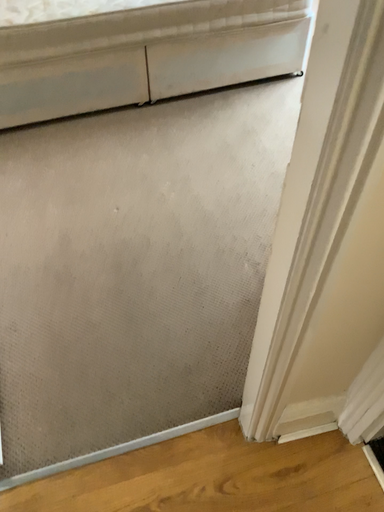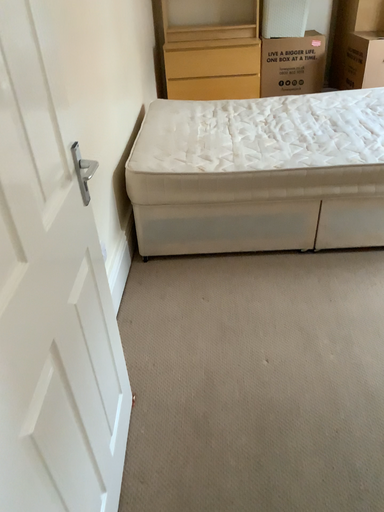
Question: Which way did the camera rotate in the video?

Choices:
 (A) rotated downward
 (B) rotated upward

Answer: (B)